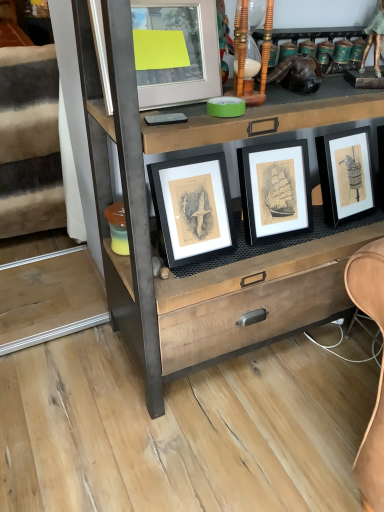
What are the coordinates of `wooden chest of drawers at center` in the screenshot? It's located at (222, 267).

Measure the distance between matte glass picture frame at upper center and camera.

They are 33.27 inches apart.

This screenshot has height=512, width=384. What do you see at coordinates (30, 142) in the screenshot?
I see `white fabric at left` at bounding box center [30, 142].

Locate an element on the screen. This screenshot has width=384, height=512. white fabric at left is located at coordinates (30, 142).

Identify the location of wooden chest of drawers at center. The width and height of the screenshot is (384, 512). (222, 267).

Considering the points (6, 219) and (172, 18), which point is in front, point (6, 219) or point (172, 18)?

The point (172, 18) is closer.

Considering the relative sizes of white fabric at left and matte glass picture frame at upper center in the image provided, is white fabric at left bigger than matte glass picture frame at upper center?

Indeed, white fabric at left has a larger size compared to matte glass picture frame at upper center.

From a real-world perspective, is white fabric at left on top of matte glass picture frame at upper center?

No, from a real-world perspective, white fabric at left is not over matte glass picture frame at upper center

Is white fabric at left inside or outside of matte glass picture frame at upper center?

white fabric at left is not inside matte glass picture frame at upper center, it's outside.

Between wooden chest of drawers at center and white fabric at left, which one has more height?

wooden chest of drawers at center is taller.

Can white fabric at left be found inside wooden chest of drawers at center?

That's incorrect, white fabric at left is not inside wooden chest of drawers at center.

The height and width of the screenshot is (512, 384). I want to click on chest of drawers on the right side of white fabric at left, so [222, 267].

From the image's perspective, which is below, wooden chest of drawers at center or white fabric at left?

wooden chest of drawers at center.

Looking at this image, considering the sizes of objects matte glass picture frame at upper center and white fabric at left in the image provided, who is wider, matte glass picture frame at upper center or white fabric at left?

With larger width is white fabric at left.

From the image's perspective, which is below, matte glass picture frame at upper center or white fabric at left?

matte glass picture frame at upper center.

Which is in front, point (210, 41) or point (44, 205)?

The point (210, 41) is in front.

Is matte glass picture frame at upper center turned away from white fabric at left?

Yes, white fabric at left is at the back of matte glass picture frame at upper center.

You are a GUI agent. You are given a task and a screenshot of the screen. Output one action in this format:
    pyautogui.click(x=<x>, y=<y>)
    Task: Click on the stairwell located on the left of wooden chest of drawers at center
    
    Given the screenshot: What is the action you would take?
    pyautogui.click(x=30, y=142)

Are white fabric at left and wooden chest of drawers at center located far from each other?

They are positioned close to each other.

In the image, is white fabric at left on the left side or the right side of wooden chest of drawers at center?

Based on their positions, white fabric at left is located to the left of wooden chest of drawers at center.

Is wooden chest of drawers at center positioned with its back to matte glass picture frame at upper center?

That's right, wooden chest of drawers at center is facing away from matte glass picture frame at upper center.

From a real-world perspective, between wooden chest of drawers at center and matte glass picture frame at upper center, who is vertically higher?

From a 3D spatial view, matte glass picture frame at upper center is above.

Looking at this image, is wooden chest of drawers at center surrounding matte glass picture frame at upper center?

Yes, wooden chest of drawers at center contains matte glass picture frame at upper center.

Considering the sizes of wooden chest of drawers at center and matte glass picture frame at upper center in the image, is wooden chest of drawers at center bigger or smaller than matte glass picture frame at upper center?

Considering their sizes, wooden chest of drawers at center takes up more space than matte glass picture frame at upper center.

In terms of size, does matte glass picture frame at upper center appear bigger or smaller than wooden chest of drawers at center?

Considering their sizes, matte glass picture frame at upper center takes up less space than wooden chest of drawers at center.

From the picture: Which object is positioned more to the left, matte glass picture frame at upper center or wooden chest of drawers at center?

From the viewer's perspective, matte glass picture frame at upper center appears more on the left side.

Based on the photo, can you tell me how much matte glass picture frame at upper center and wooden chest of drawers at center differ in facing direction?

7.39 degrees.

Is matte glass picture frame at upper center positioned with its back to wooden chest of drawers at center?

Yes, wooden chest of drawers at center is at the back of matte glass picture frame at upper center.

Find the location of `picture frame lying in front of the white fabric at left`. picture frame lying in front of the white fabric at left is located at coordinates (176, 52).

Where is `stairwell that appears on the left of wooden chest of drawers at center`? The image size is (384, 512). stairwell that appears on the left of wooden chest of drawers at center is located at coordinates (30, 142).

Considering their positions, is wooden chest of drawers at center positioned further to white fabric at left than matte glass picture frame at upper center?

matte glass picture frame at upper center is further to white fabric at left.

Looking at the image, which one is located closer to wooden chest of drawers at center, matte glass picture frame at upper center or white fabric at left?

Based on the image, matte glass picture frame at upper center appears to be nearer to wooden chest of drawers at center.

When comparing their distances from matte glass picture frame at upper center, does wooden chest of drawers at center or white fabric at left seem further?

white fabric at left lies further to matte glass picture frame at upper center than the other object.

Looking at the image, which one is located further to white fabric at left, matte glass picture frame at upper center or wooden chest of drawers at center?

The object further to white fabric at left is matte glass picture frame at upper center.

Estimate the real-world distances between objects in this image. Which object is closer to matte glass picture frame at upper center, white fabric at left or wooden chest of drawers at center?

Among the two, wooden chest of drawers at center is located nearer to matte glass picture frame at upper center.

Which object lies further to the anchor point wooden chest of drawers at center, white fabric at left or matte glass picture frame at upper center?

Based on the image, white fabric at left appears to be further to wooden chest of drawers at center.

Find the location of `picture frame between white fabric at left and wooden chest of drawers at center from left to right`. picture frame between white fabric at left and wooden chest of drawers at center from left to right is located at coordinates (176, 52).